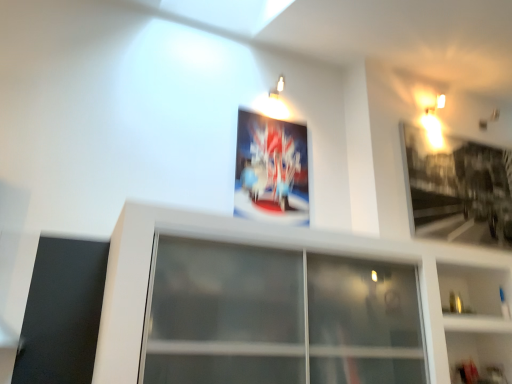
Question: Is metallic silver picture frame at upper right, the 1th picture frame viewed from the right, to the left or to the right of transparent glass window at center in the image?

Choices:
 (A) right
 (B) left

Answer: (A)

Question: Considering their positions, is metallic silver picture frame at upper right, the 1th picture frame viewed from the right, located in front of or behind transparent glass window at center?

Choices:
 (A) behind
 (B) front

Answer: (A)

Question: Estimate the real-world distances between objects in this image. Which object is closer to the transparent glass window at center?

Choices:
 (A) white glossy shelf at lower right
 (B) metallic silver picture frame at upper right, which is the 2th picture frame in left-to-right order
 (C) metallic poster at center, which is counted as the first picture frame, starting from the left

Answer: (A)

Question: Considering the real-world distances, which object is closest to the metallic silver picture frame at upper right, the 1th picture frame viewed from the right?

Choices:
 (A) metallic poster at center, which is counted as the first picture frame, starting from the left
 (B) transparent glass window at center
 (C) white glossy shelf at lower right

Answer: (C)